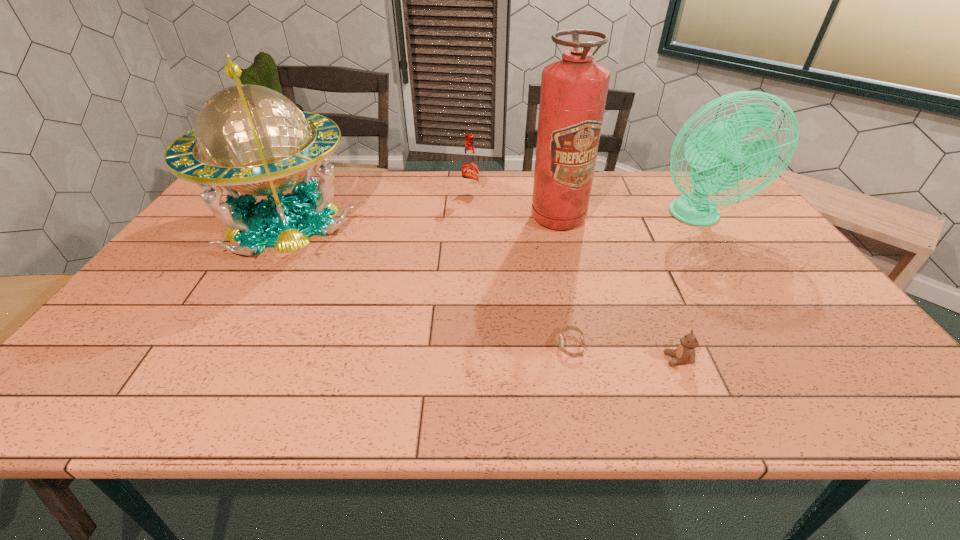
Point out which object is positioned as the fifth nearest to the root beer. Please provide its 2D coordinates. Your answer should be formatted as a tuple, i.e. [(x, y)], where the tuple contains the x and y coordinates of a point satisfying the conditions above.

[(685, 353)]

This screenshot has width=960, height=540. I want to click on free point that satisfies the following two spatial constraints: 1. in front of the rightmost object to blow air; 2. on the face of the shortest object, so click(782, 346).